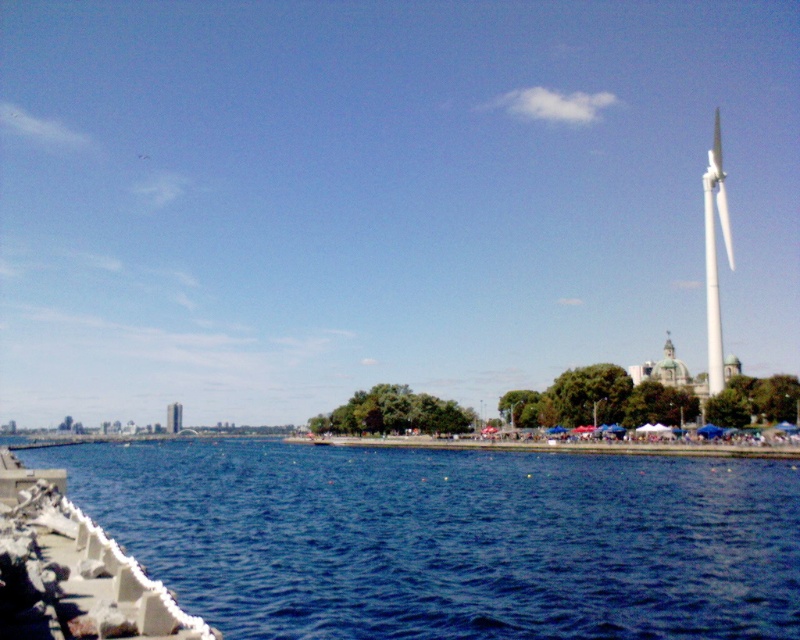
Question: Does blue water at lower left have a larger size compared to white smooth wind turbine at right?

Choices:
 (A) no
 (B) yes

Answer: (A)

Question: Which object appears farthest from the camera in this image?

Choices:
 (A) blue water at lower left
 (B) white smooth wind turbine at right

Answer: (B)

Question: In this image, where is blue water at lower left located relative to white smooth wind turbine at right?

Choices:
 (A) below
 (B) above

Answer: (A)

Question: Is blue water at lower left smaller than white smooth wind turbine at right?

Choices:
 (A) yes
 (B) no

Answer: (A)